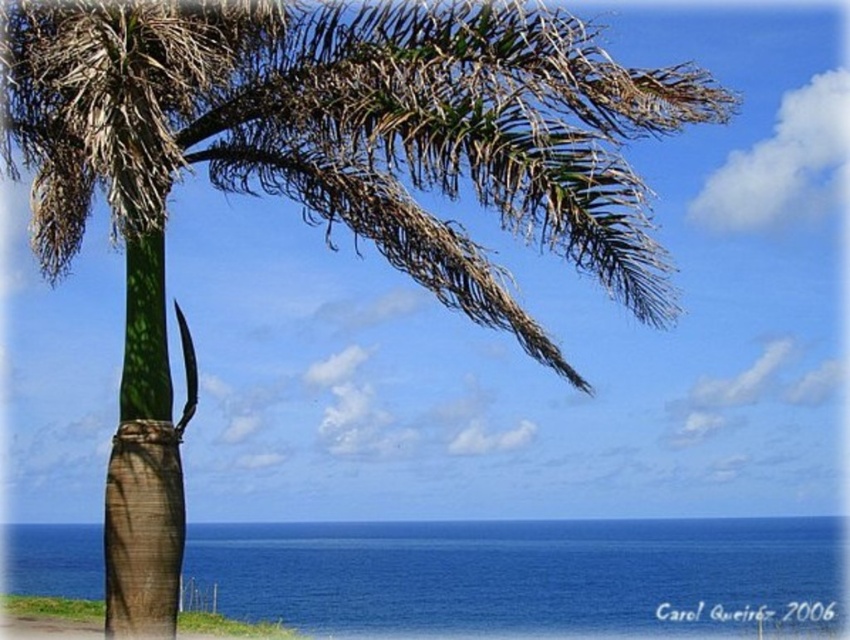
Is blue liquid water at lower center below smooth sand at lower left?

Actually, blue liquid water at lower center is above smooth sand at lower left.

How far apart are blue liquid water at lower center and smooth sand at lower left?

blue liquid water at lower center is 10.66 feet from smooth sand at lower left.

Locate an element on the screen. Image resolution: width=850 pixels, height=640 pixels. blue liquid water at lower center is located at coordinates (527, 576).